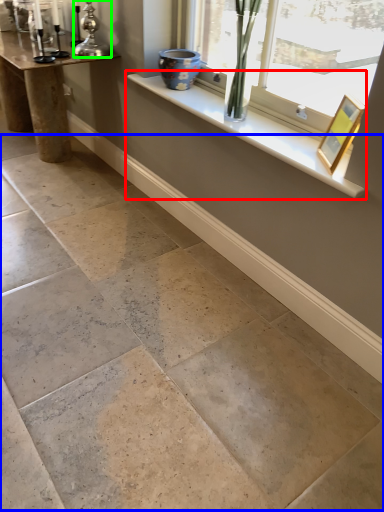
Question: Which is farther away from window sill (highlighted by a red box)? concrete (highlighted by a blue box) or candle holder (highlighted by a green box)?

Choices:
 (A) concrete
 (B) candle holder

Answer: (A)